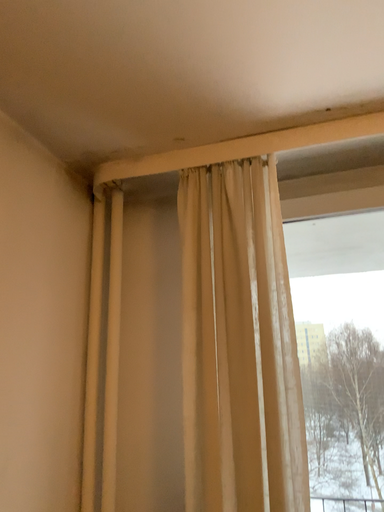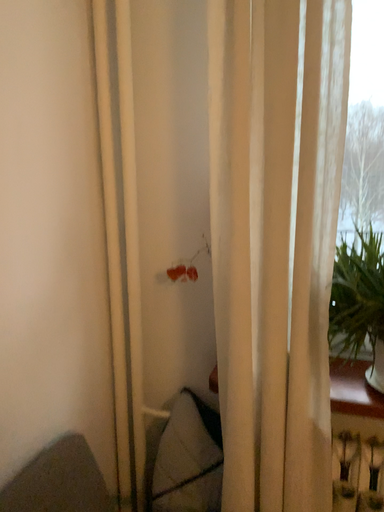
Question: How did the camera likely rotate when shooting the video?

Choices:
 (A) rotated downward
 (B) rotated upward

Answer: (A)